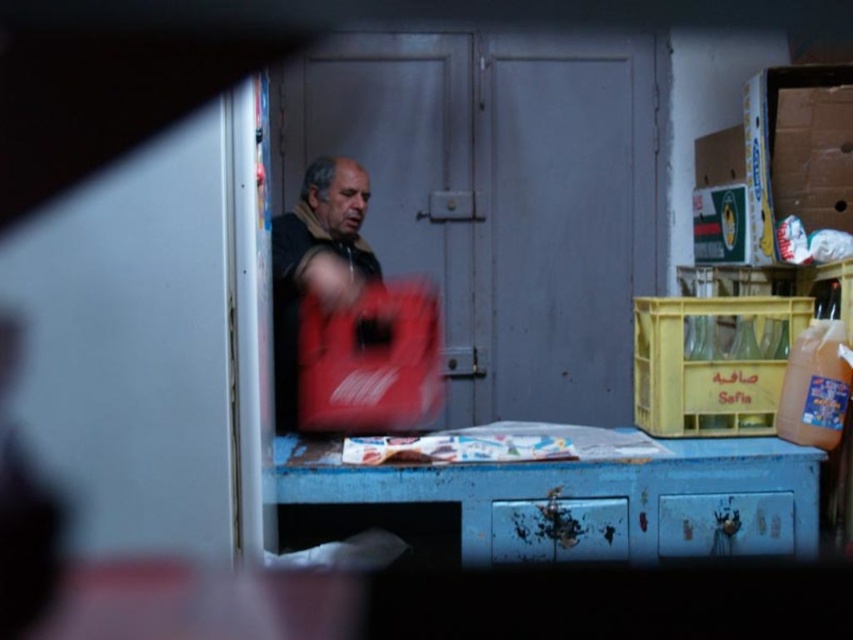
You are standing in the shop and want to place an item on the blue painted wood table at lower center. Based on its position coordinates, can you estimate where exactly on the table you should place the item to ensure it stays centered?

The blue painted wood table at lower center is located at coordinates point (587,493), so placing the item at the center of the table would mean positioning it near the middle of these coordinates.

You are standing in the shop and see two points marked on the image. The first point is at coordinates point (x=691, y=499) and the second point is at point (x=379, y=336). Which point is closer to you?

Point (x=691, y=499) is closer to the camera than point (x=379, y=336).